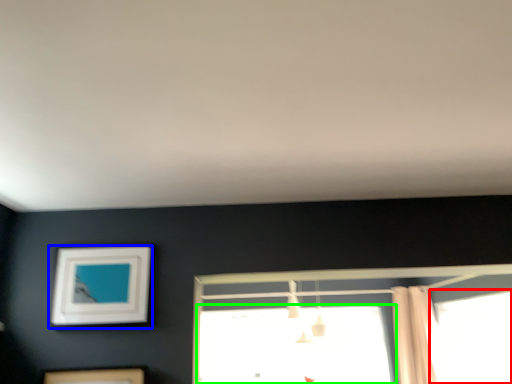
Question: Based on their relative distances, which object is nearer to window (highlighted by a red box)? Choose from picture frame (highlighted by a blue box) and window (highlighted by a green box).

Choices:
 (A) picture frame
 (B) window

Answer: (B)